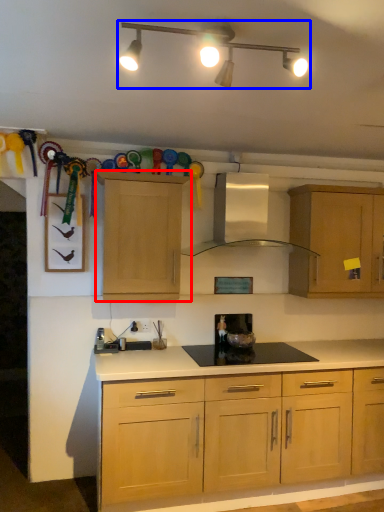
Question: Which point is closer to the camera, cabinetry (highlighted by a red box) or light fixture (highlighted by a blue box)?

Choices:
 (A) cabinetry
 (B) light fixture

Answer: (B)